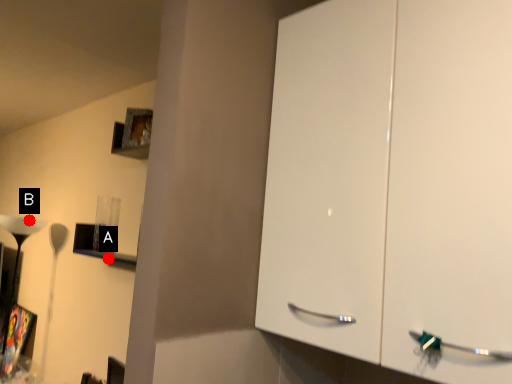
Question: Two points are circled on the image, labeled by A and B beside each circle. Among these points, which one is farthest from the camera?

Choices:
 (A) A is further
 (B) B is further

Answer: (B)